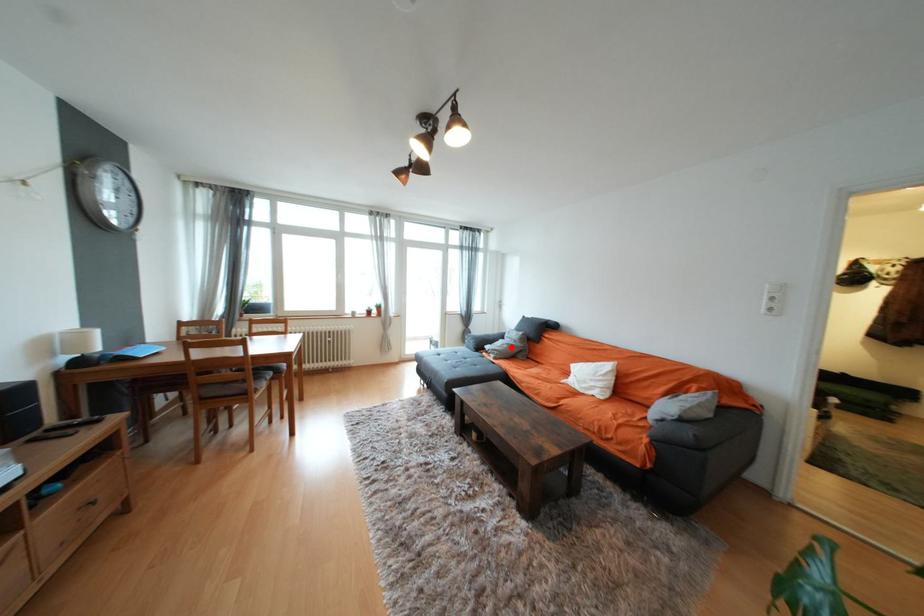
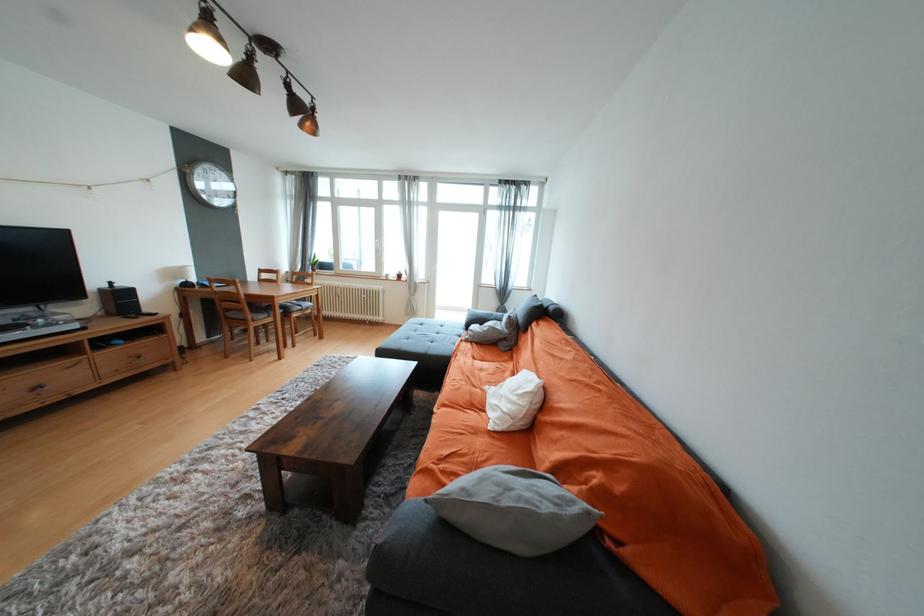
In the second image, find the point that corresponds to the highlighted location in the first image.

(492, 330)